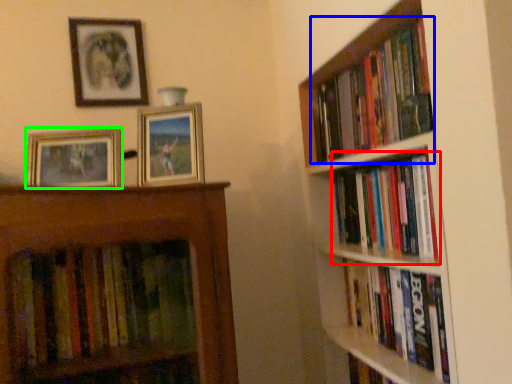
Question: Considering the real-world distances, which object is farthest from book (highlighted by a red box)? book (highlighted by a blue box) or picture frame (highlighted by a green box)?

Choices:
 (A) book
 (B) picture frame

Answer: (B)